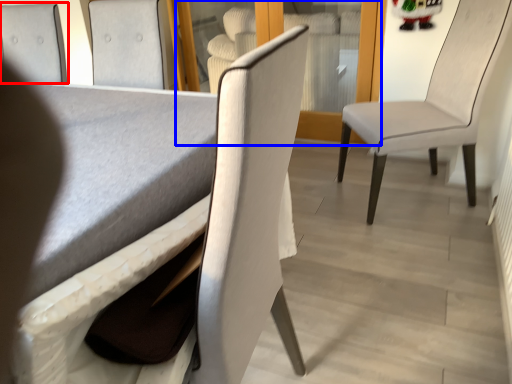
Question: Which of the following is the farthest to the observer, chair (highlighted by a red box) or glass door (highlighted by a blue box)?

Choices:
 (A) chair
 (B) glass door

Answer: (B)